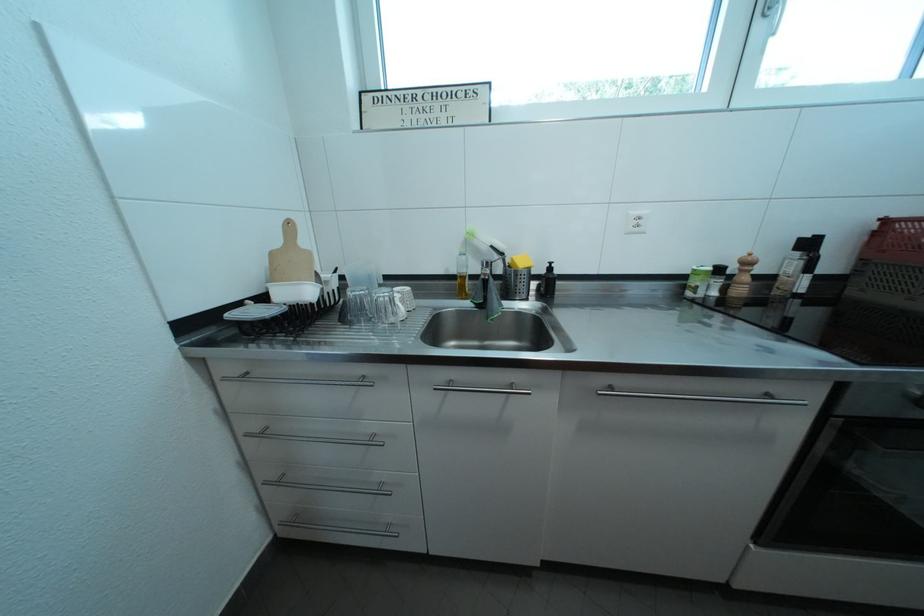
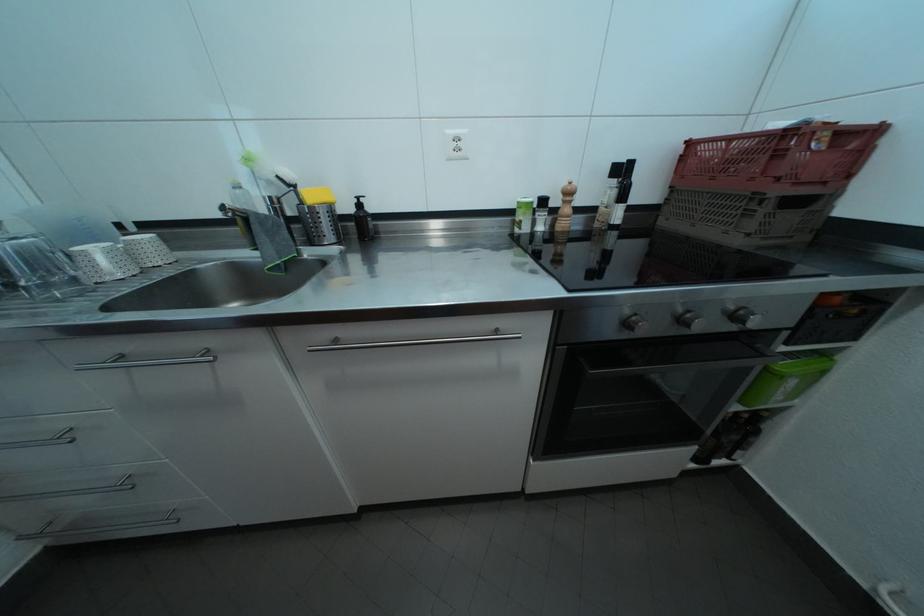
Question: What movement of the cameraman would produce the second image?

Choices:
 (A) Left
 (B) Right
 (C) Forward
 (D) Backward

Answer: (B)